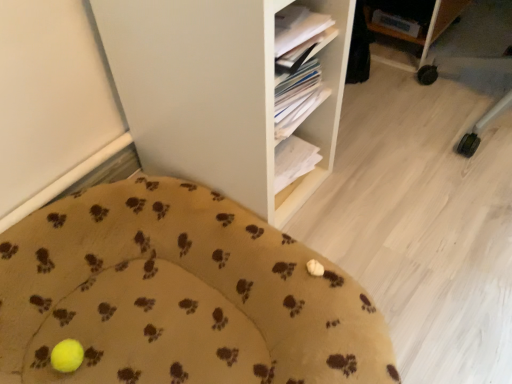
Question: From the image's perspective, is yellow fabric cushion at lower left located above or below white matte shelf at center?

Choices:
 (A) above
 (B) below

Answer: (B)

Question: Do you think yellow fabric cushion at lower left is within white matte shelf at center, or outside of it?

Choices:
 (A) inside
 (B) outside

Answer: (B)

Question: Is yellow fabric cushion at lower left in front of or behind white matte shelf at center in the image?

Choices:
 (A) behind
 (B) front

Answer: (B)

Question: Considering the positions of white matte shelf at center and yellow fabric cushion at lower left in the image, is white matte shelf at center wider or thinner than yellow fabric cushion at lower left?

Choices:
 (A) wide
 (B) thin

Answer: (B)

Question: Considering the positions of point (267, 187) and point (231, 213), is point (267, 187) closer or farther from the camera than point (231, 213)?

Choices:
 (A) closer
 (B) farther

Answer: (A)

Question: Would you say white matte shelf at center is to the left or to the right of yellow fabric cushion at lower left in the picture?

Choices:
 (A) right
 (B) left

Answer: (A)

Question: In terms of height, does white matte shelf at center look taller or shorter compared to yellow fabric cushion at lower left?

Choices:
 (A) tall
 (B) short

Answer: (A)